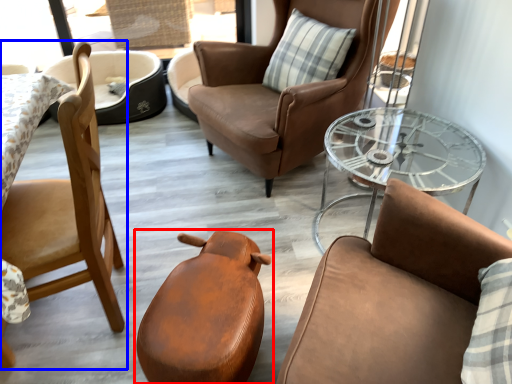
Question: Which of the following is the farthest to the observer, chair (highlighted by a red box) or chair (highlighted by a blue box)?

Choices:
 (A) chair
 (B) chair

Answer: (A)